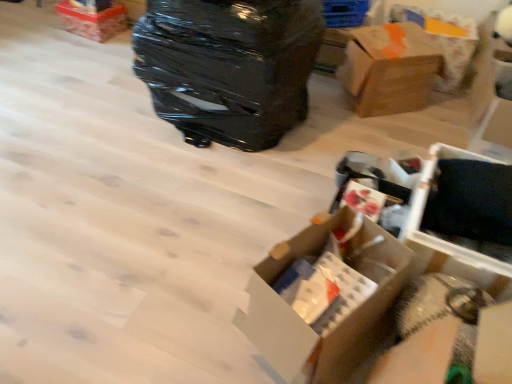
Question: From a real-world perspective, is cardboard box at upper right under white plastic storage box at lower right, placed as the first storage box when sorted from bottom to top?

Choices:
 (A) yes
 (B) no

Answer: (B)

Question: Can you confirm if cardboard box at upper right is positioned to the left of white plastic storage box at lower right, which is the second storage box in top-to-bottom order?

Choices:
 (A) yes
 (B) no

Answer: (B)

Question: Is cardboard box at upper right closer to the viewer compared to white plastic storage box at lower right, placed as the first storage box when sorted from bottom to top?

Choices:
 (A) no
 (B) yes

Answer: (A)

Question: From the image's perspective, is cardboard box at upper right on white plastic storage box at lower right, which is the second storage box in top-to-bottom order?

Choices:
 (A) no
 (B) yes

Answer: (B)

Question: Is white plastic storage box at lower right, the first storage box in the front-to-back sequence, surrounded by cardboard box at upper right?

Choices:
 (A) no
 (B) yes

Answer: (A)

Question: Considering the positions of blue plastic storage box at upper center, positioned as the second storage box in bottom-to-top order, and white cardboard box at center, the 2th box positioned from the right, in the image, is blue plastic storage box at upper center, positioned as the second storage box in bottom-to-top order, bigger or smaller than white cardboard box at center, the 2th box positioned from the right,?

Choices:
 (A) big
 (B) small

Answer: (B)

Question: Is blue plastic storage box at upper center, which is the second storage box in front-to-back order, to the left or to the right of white cardboard box at center, which ranks as the third box in top-to-bottom order, in the image?

Choices:
 (A) left
 (B) right

Answer: (B)

Question: From a real-world perspective, is blue plastic storage box at upper center, positioned as the second storage box in bottom-to-top order, positioned above or below white cardboard box at center, the 1th box in the bottom-to-top sequence?

Choices:
 (A) below
 (B) above

Answer: (B)

Question: Is point (330, 13) closer or farther from the camera than point (339, 244)?

Choices:
 (A) farther
 (B) closer

Answer: (A)

Question: From a real-world perspective, is cardboard box at upper right positioned above or below blue plastic storage box at upper center, which is the second storage box in front-to-back order?

Choices:
 (A) above
 (B) below

Answer: (B)

Question: Based on their sizes in the image, would you say cardboard box at upper right is bigger or smaller than blue plastic storage box at upper center, which is the second storage box in front-to-back order?

Choices:
 (A) small
 (B) big

Answer: (B)

Question: Is cardboard box at upper right in front of or behind blue plastic storage box at upper center, positioned as the 1th storage box in top-to-bottom order, in the image?

Choices:
 (A) behind
 (B) front

Answer: (B)

Question: Is cardboard box at upper right inside the boundaries of blue plastic storage box at upper center, the 1th storage box positioned from the back, or outside?

Choices:
 (A) outside
 (B) inside

Answer: (A)

Question: Considering the positions of point coord(354,74) and point coord(476,279), is point coord(354,74) closer or farther from the camera than point coord(476,279)?

Choices:
 (A) closer
 (B) farther

Answer: (B)

Question: From the image's perspective, is brown cardboard box at upper right, positioned as the second box in front-to-back order, located above or below white plastic storage box at lower right, the first storage box in the front-to-back sequence?

Choices:
 (A) above
 (B) below

Answer: (A)